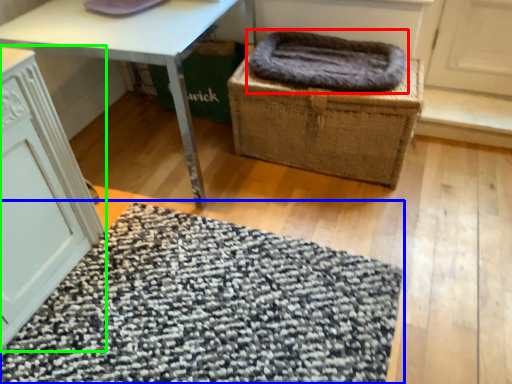
Question: Which is farther away from blanket (highlighted by a red box)? mat (highlighted by a blue box) or cabinetry (highlighted by a green box)?

Choices:
 (A) mat
 (B) cabinetry

Answer: (B)